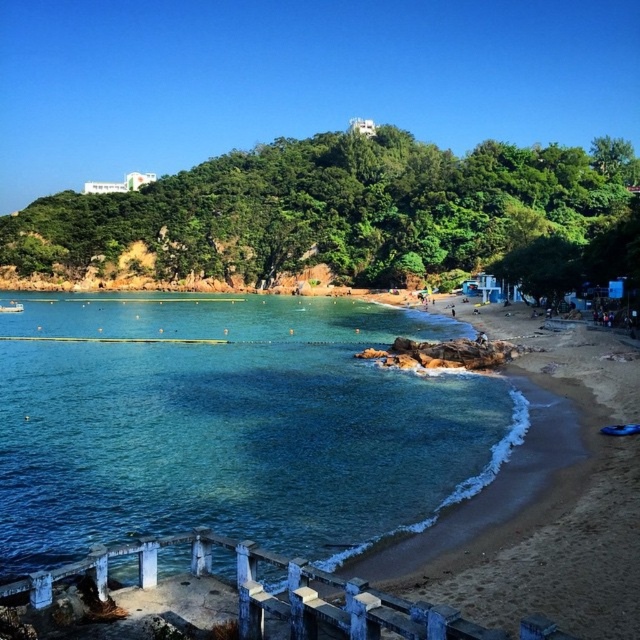
Question: Can you confirm if clear blue water at lower left is positioned below sandy beach at lower right?

Choices:
 (A) no
 (B) yes

Answer: (A)

Question: Which object appears closest to the camera in this image?

Choices:
 (A) sandy beach at lower right
 (B) clear blue water at lower left

Answer: (A)

Question: Does clear blue water at lower left appear on the left side of sandy beach at lower right?

Choices:
 (A) yes
 (B) no

Answer: (A)

Question: Which point is closer to the camera?

Choices:
 (A) (100, 365)
 (B) (448, 522)

Answer: (B)

Question: Which object is closer to the camera taking this photo?

Choices:
 (A) clear blue water at lower left
 (B) sandy beach at lower right

Answer: (B)

Question: Does clear blue water at lower left appear under sandy beach at lower right?

Choices:
 (A) yes
 (B) no

Answer: (B)